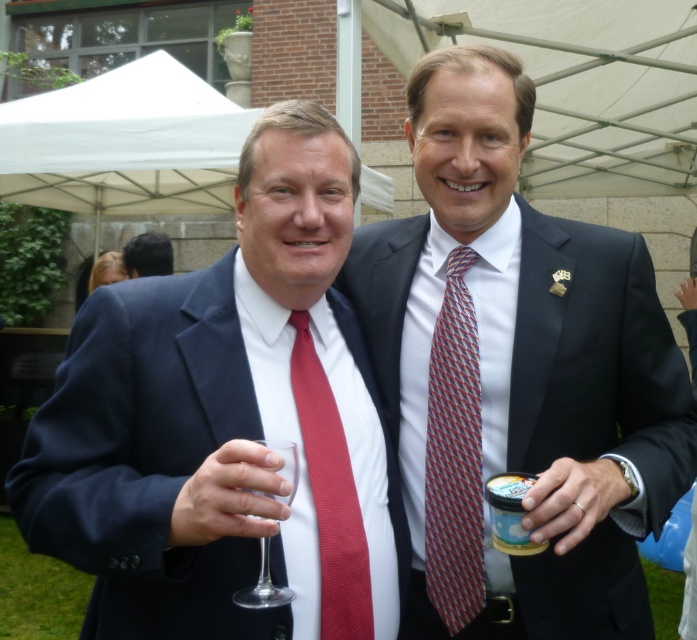
Who is higher up, matte black suit at center or clear glass wine glass at lower left?

matte black suit at center

This screenshot has height=640, width=697. Identify the location of matte black suit at center. (516, 372).

Between point (413, 260) and point (268, 570), which one is positioned in front?

Point (268, 570) is more forward.

Find the location of a particular element. The width and height of the screenshot is (697, 640). matte black suit at center is located at coordinates (516, 372).

Which is behind, point (496, 520) or point (261, 550)?

Point (496, 520)

Between point (519, 545) and point (266, 579), which one is positioned behind?

Positioned behind is point (519, 545).

Where is `white plastic cup at right`? white plastic cup at right is located at coordinates (510, 513).

Measure the distance between matte red tie at left and camera.

They are 38.25 inches apart.

Is matte red tie at left to the right of multicolored woven tie at center from the viewer's perspective?

In fact, matte red tie at left is to the left of multicolored woven tie at center.

Which is in front, point (351, 556) or point (454, 518)?

Point (351, 556) is in front.

In order to click on matte red tie at left in this screenshot , I will do `click(227, 422)`.